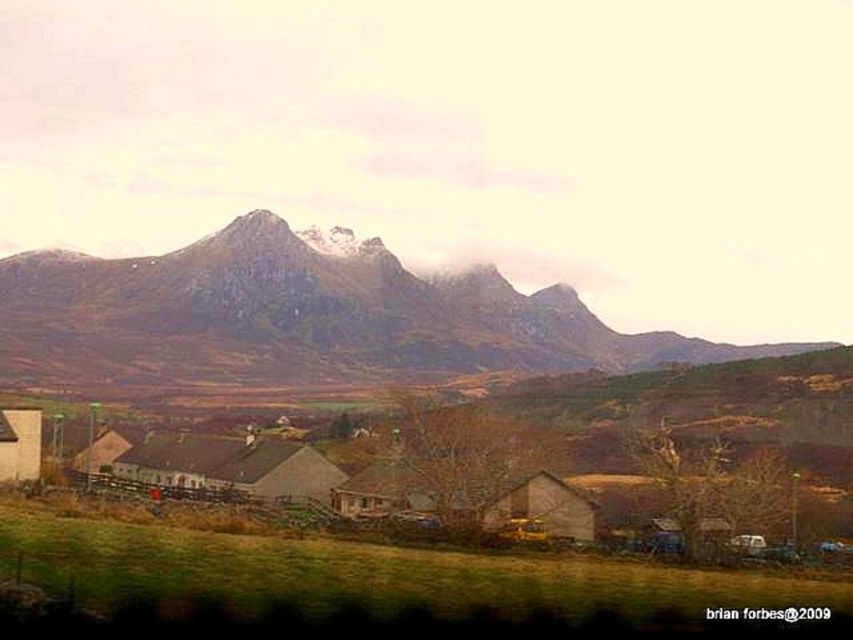
Does rocky gray mountain at upper center appear on the right side of brown wooden house at center?

Incorrect, rocky gray mountain at upper center is not on the right side of brown wooden house at center.

Based on the photo, does rocky gray mountain at upper center appear over brown wooden house at center?

Correct, rocky gray mountain at upper center is located above brown wooden house at center.

Is point (405, 308) positioned before point (497, 525)?

No, it is behind (497, 525).

The width and height of the screenshot is (853, 640). Identify the location of rocky gray mountain at upper center. (300, 317).

Is point (498, 512) in front of point (0, 451)?

Yes, it is in front of point (0, 451).

At what (x,y) coordinates should I click in order to perform the action: click on matte gray barns at center. Please return your answer as a coordinate pair (x, y). Looking at the image, I should click on (596, 484).

The height and width of the screenshot is (640, 853). What do you see at coordinates (231, 465) in the screenshot?
I see `brown wooden hut at lower left` at bounding box center [231, 465].

Can you confirm if brown wooden hut at lower left is positioned to the right of matte white hut at lower left?

Yes, brown wooden hut at lower left is to the right of matte white hut at lower left.

Which is behind, point (294, 476) or point (36, 433)?

Positioned behind is point (294, 476).

The width and height of the screenshot is (853, 640). Find the location of `brown wooden hut at lower left`. brown wooden hut at lower left is located at coordinates (231, 465).